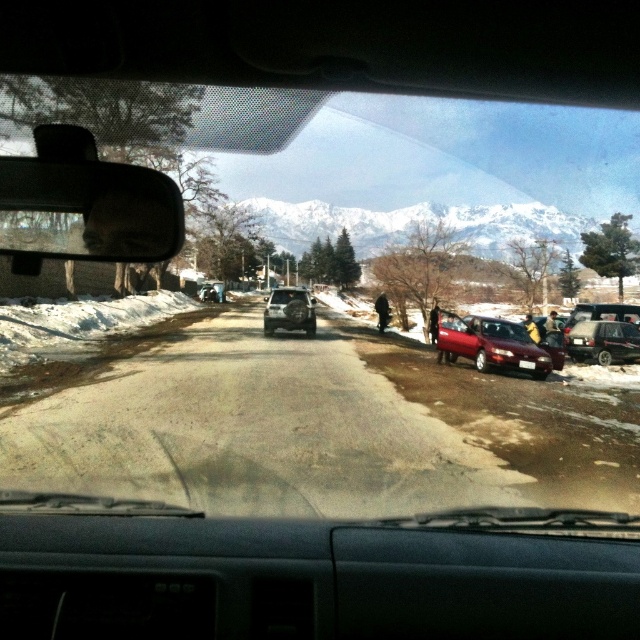
You are driving a car and see the matte red sedan at center ahead. If your car is 4.5 meters long, can you safely pass it within the next 20 meters without hitting it?

The matte red sedan at center is 17.69 meters away from viewer. Since your car is 4.5 meters long, you need at least 17.69 meters plus 4.5 meters to safely pass. However, the available distance is only 20 meters, which is insufficient. Therefore, you cannot safely pass the matte red sedan at center within the next 20 meters without risking a collision.

You are a passenger in the vehicle and notice the black fabric person at center and the yellow fabric bag at right through the windshield. Which object is wider?

The yellow fabric bag at right is wider than the black fabric person at center.

You are driving a car and see the metallic silver sedan at right and the black fabric person at center. Which object is closer to you?

The black fabric person at center is closer to you because the metallic silver sedan at right is 11.78 meters away from it, meaning the person is nearer to your position in the vehicle.